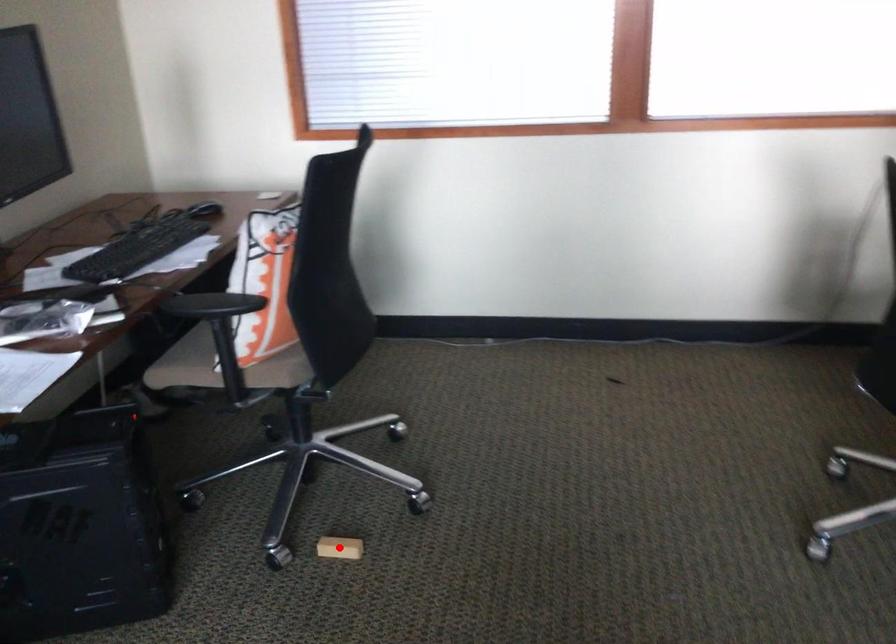
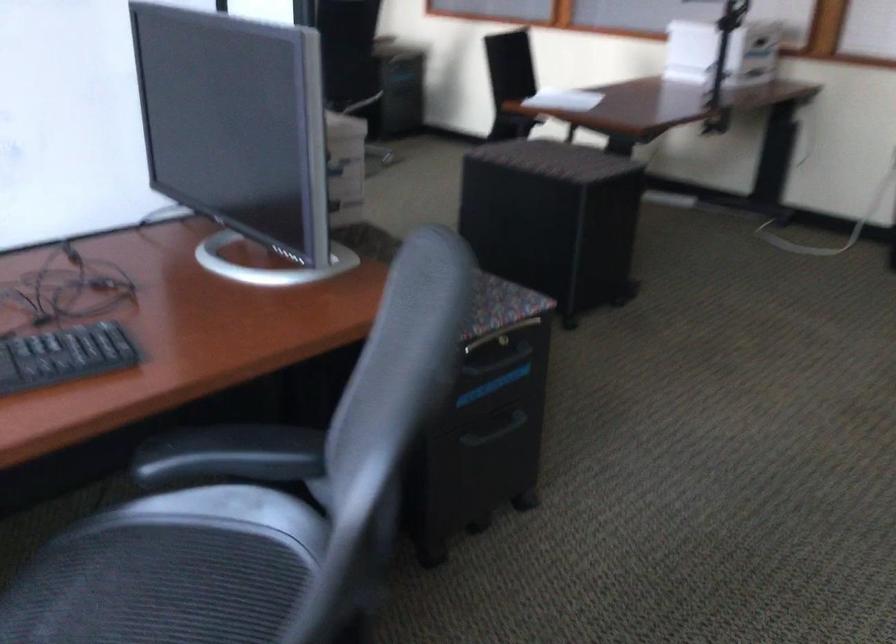
Question: I am providing you with two images of the same scene from different viewpoints. A red point is marked on the first image. Can you still see the location of the red point in image 2?

Choices:
 (A) Yes
 (B) No

Answer: (B)